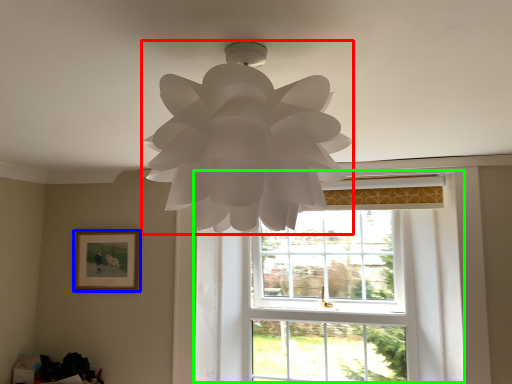
Question: Which object is the closest to the lamp (highlighted by a red box)? Choose among these: picture frame (highlighted by a blue box) or window (highlighted by a green box).

Choices:
 (A) picture frame
 (B) window

Answer: (B)